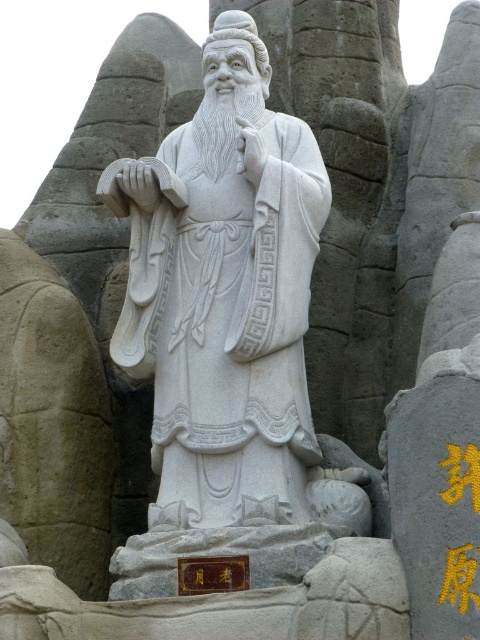
Can you confirm if white marble statue at center is positioned to the right of white stone carving at center?

In fact, white marble statue at center is to the left of white stone carving at center.

Can you confirm if white marble statue at center is positioned below white stone carving at center?

Indeed, white marble statue at center is positioned under white stone carving at center.

Who is more distant from viewer, (x=197, y=212) or (x=243, y=280)?

The point (x=197, y=212) is behind.

The width and height of the screenshot is (480, 640). What are the coordinates of `white marble statue at center` in the screenshot? It's located at (227, 304).